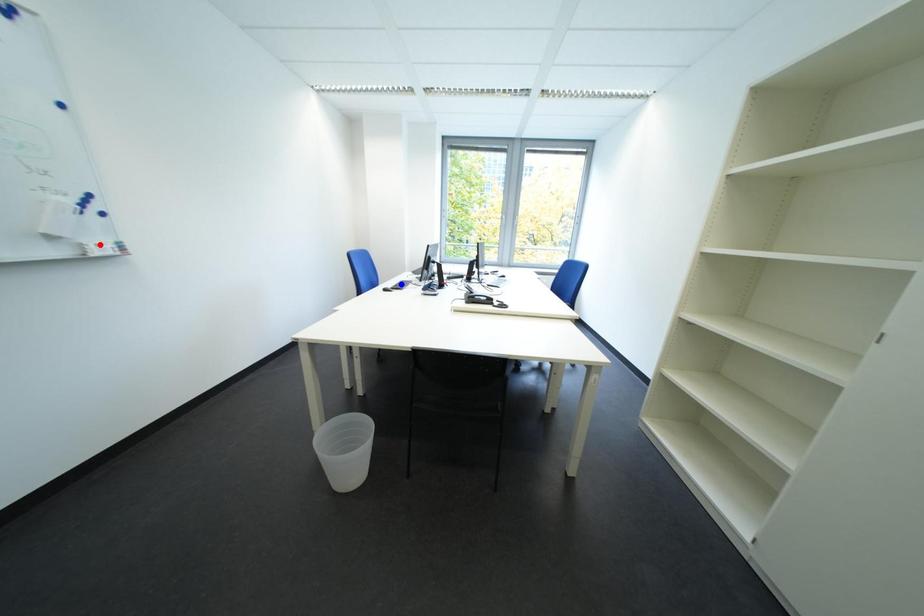
Question: In the image, two points are highlighted. Which point is nearer to the camera? Reply with the corresponding letter.

Choices:
 (A) blue point
 (B) red point

Answer: (B)